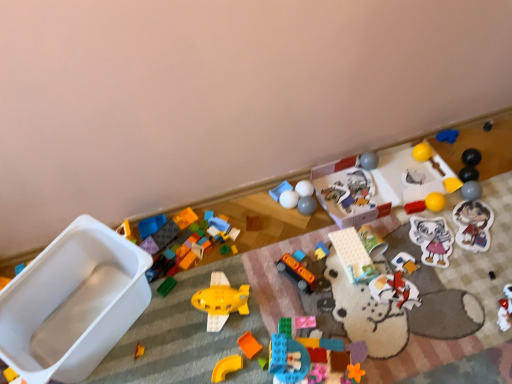
Locate an element on the screen. Image resolution: width=512 pixels, height=384 pixels. free space to the left of orange matte block at center, which is the twentieth toy from right to left is located at coordinates (201, 347).